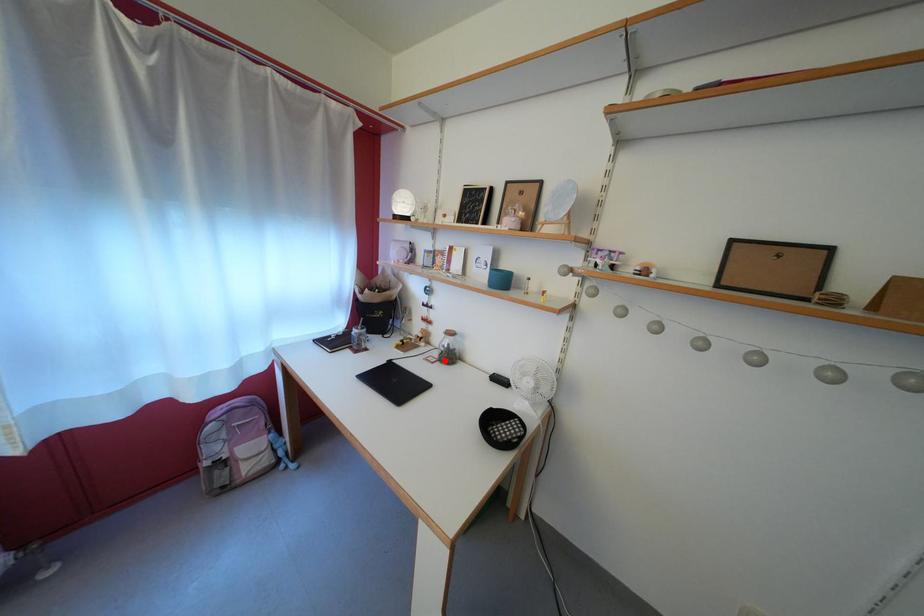
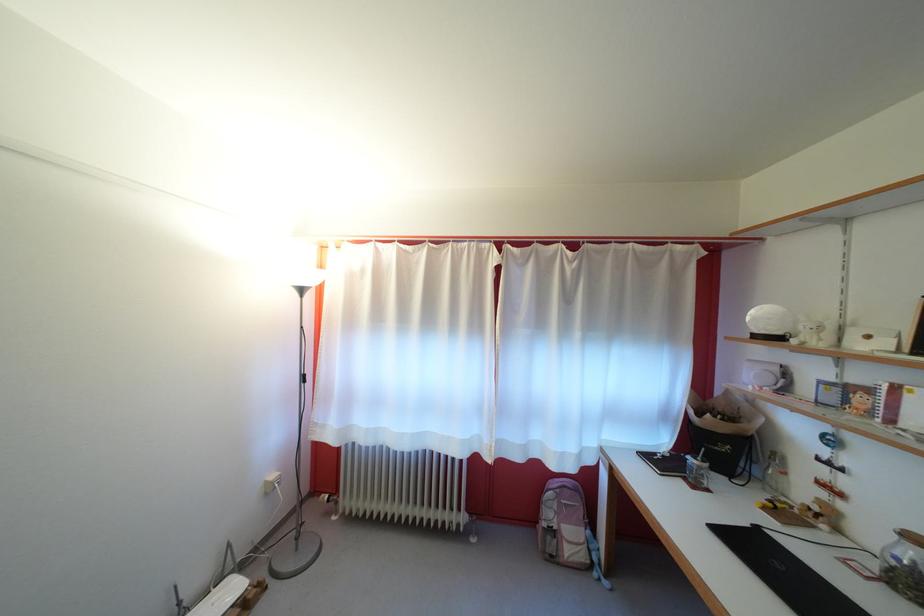
Where in the second image is the point corresponding to the highlighted location from the first image?

(881, 570)